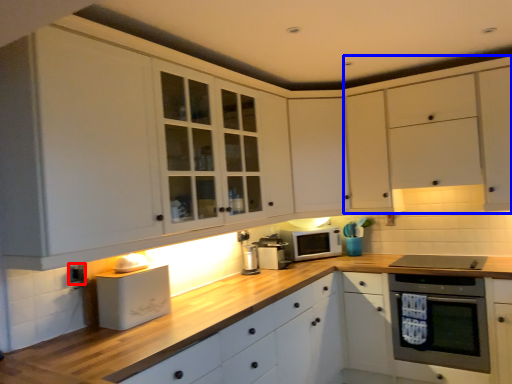
Question: Which object is further to the camera taking this photo, electric outlet (highlighted by a red box) or cabinetry (highlighted by a blue box)?

Choices:
 (A) electric outlet
 (B) cabinetry

Answer: (B)